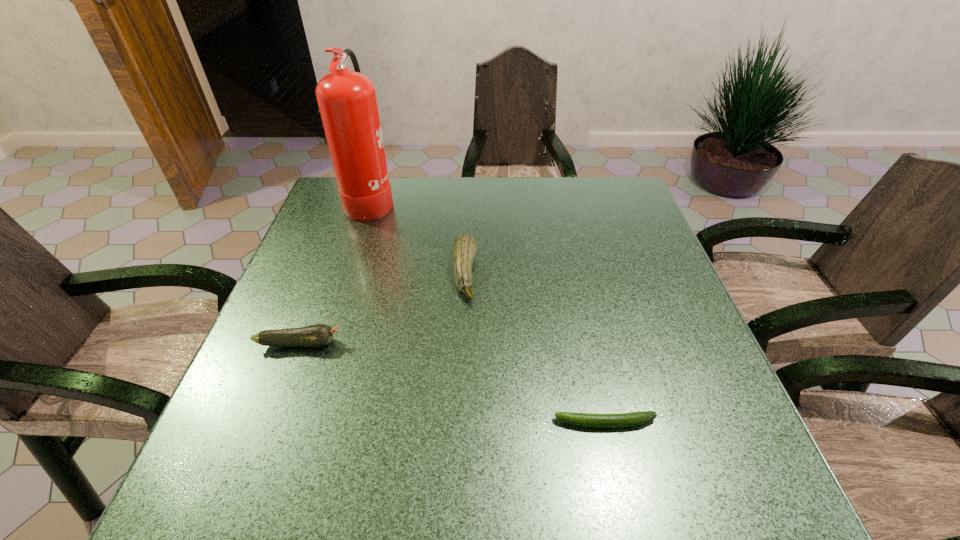
Find the location of a particular element. This screenshot has height=540, width=960. free space between the fire extinguisher and the leftmost zucchini is located at coordinates (335, 271).

The height and width of the screenshot is (540, 960). I want to click on vacant space that is in between the third nearest object and the nearest object, so click(535, 348).

Where is `vacant area that lies between the shortest zucchini and the second farthest zucchini`? vacant area that lies between the shortest zucchini and the second farthest zucchini is located at coordinates (452, 383).

At what (x,y) coordinates should I click in order to perform the action: click on free space between the second shortest object and the second object from right to left. Please return your answer as a coordinate pair (x, y). The image size is (960, 540). Looking at the image, I should click on (382, 308).

Locate an element on the screen. The height and width of the screenshot is (540, 960). free space between the leftmost zucchini and the farthest object is located at coordinates (335, 271).

In order to click on object that is the third closest one to the shortest object in this screenshot , I will do `click(347, 101)`.

Where is `object that ranks as the second closest to the third object from left to right`? The height and width of the screenshot is (540, 960). object that ranks as the second closest to the third object from left to right is located at coordinates (318, 335).

Select which zucchini appears as the second closest to the second nearest zucchini. Please provide its 2D coordinates. Your answer should be formatted as a tuple, i.e. [(x, y)], where the tuple contains the x and y coordinates of a point satisfying the conditions above.

[(620, 420)]

The height and width of the screenshot is (540, 960). I want to click on zucchini that is the second closest to the nearest object, so click(x=318, y=335).